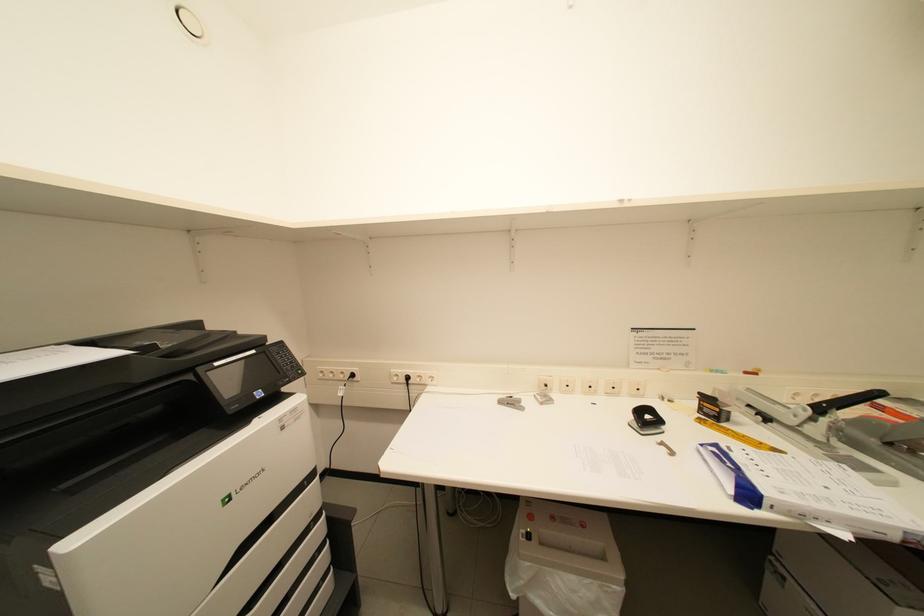
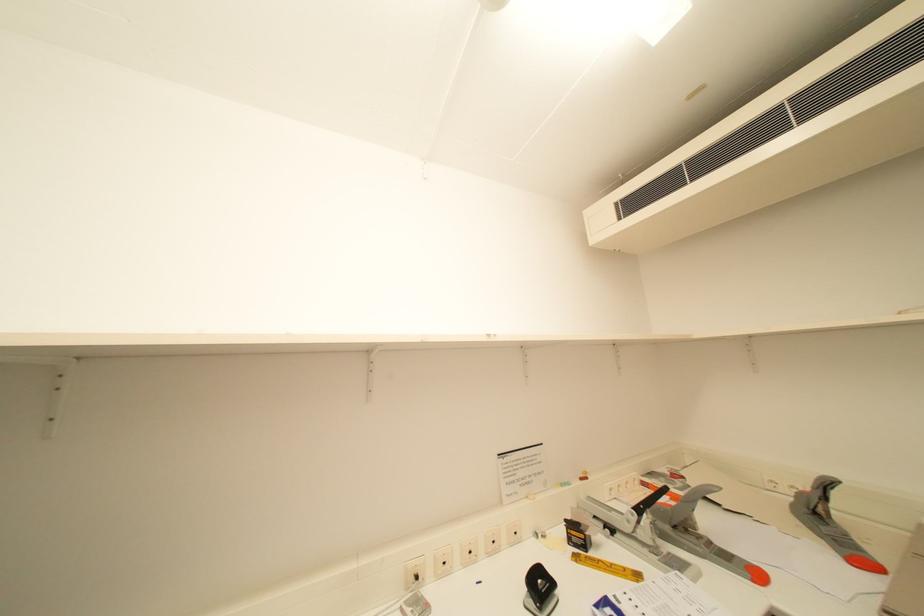
The images are taken continuously from a first-person perspective. In which direction is your viewpoint rotating?

The camera rotated toward right-up.